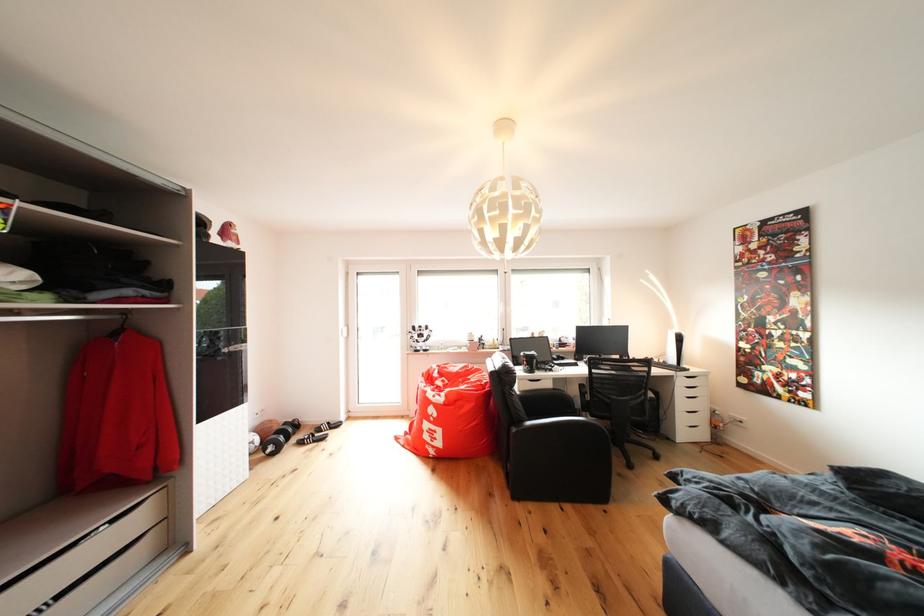
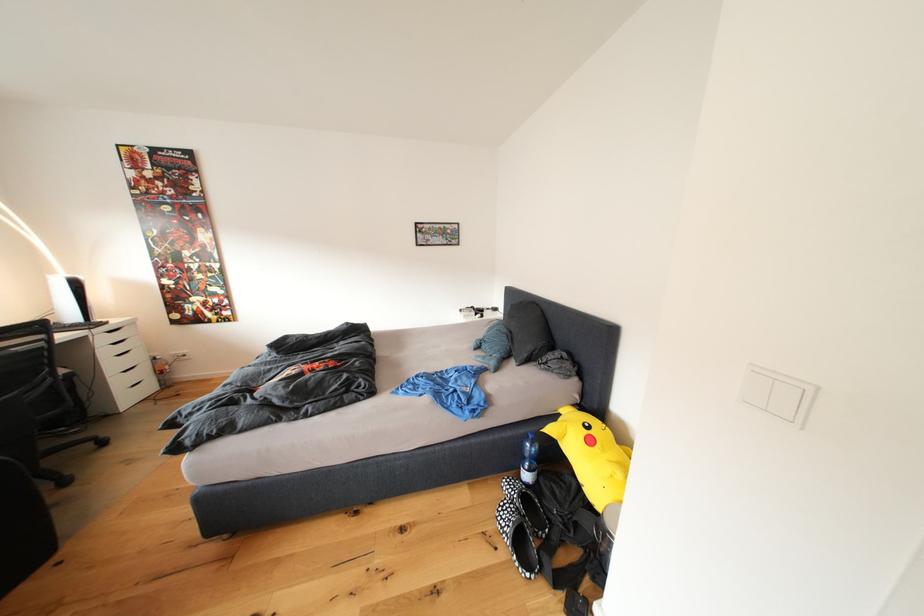
Find the pixel in the second image that matches [711,426] in the first image.

(152, 379)